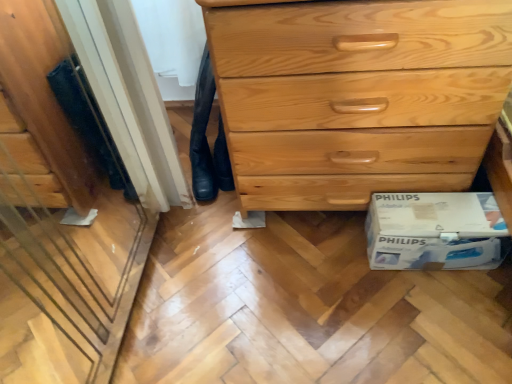
Locate an element on the screen. This screenshot has height=384, width=512. black leather jeans at lower center is located at coordinates (206, 140).

In order to click on light wood chest of drawers at center in this screenshot , I will do `click(357, 96)`.

Where is `black leather jeans at lower center`? This screenshot has width=512, height=384. black leather jeans at lower center is located at coordinates (206, 140).

From a real-world perspective, is light wood chest of drawers at center above or below white cardboard box at lower right?

From a real-world perspective, light wood chest of drawers at center is physically above white cardboard box at lower right.

Is light wood chest of drawers at center far away from white cardboard box at lower right?

No, light wood chest of drawers at center is not far from white cardboard box at lower right.

From the image's perspective, between light wood chest of drawers at center and white cardboard box at lower right, who is located below?

white cardboard box at lower right.

How many degrees apart are the facing directions of light wood chest of drawers at center and white cardboard box at lower right?

2.2 degrees.

How many degrees apart are the facing directions of white cardboard box at lower right and black leather jeans at lower center?

They differ by 2.2 degrees in their facing directions.

Where is `cardboard box in front of the black leather jeans at lower center`? This screenshot has width=512, height=384. cardboard box in front of the black leather jeans at lower center is located at coordinates (435, 231).

Is white cardboard box at lower right in contact with black leather jeans at lower center?

No, white cardboard box at lower right is not making contact with black leather jeans at lower center.

Considering the relative sizes of white cardboard box at lower right and black leather jeans at lower center in the image provided, is white cardboard box at lower right taller than black leather jeans at lower center?

No.

Between black leather jeans at lower center and white cardboard box at lower right, which one has smaller size?

black leather jeans at lower center is smaller.

Does black leather jeans at lower center turn towards white cardboard box at lower right?

No, black leather jeans at lower center does not turn towards white cardboard box at lower right.

Measure the distance from black leather jeans at lower center to white cardboard box at lower right.

The distance of black leather jeans at lower center from white cardboard box at lower right is 23.07 inches.

I want to click on cardboard box beneath the black leather jeans at lower center (from a real-world perspective), so click(x=435, y=231).

Are black leather jeans at lower center and light wood chest of drawers at center making contact?

There is a gap between black leather jeans at lower center and light wood chest of drawers at center.

Can you confirm if black leather jeans at lower center is bigger than light wood chest of drawers at center?

A: Actually, black leather jeans at lower center might be smaller than light wood chest of drawers at center.

From the image's perspective, relative to light wood chest of drawers at center, is black leather jeans at lower center above or below?

black leather jeans at lower center is below light wood chest of drawers at center.

Would you say light wood chest of drawers at center is part of black leather jeans at lower center's contents?

Actually, light wood chest of drawers at center is outside black leather jeans at lower center.

How different are the orientations of light wood chest of drawers at center and black leather jeans at lower center in degrees?

The angular difference between light wood chest of drawers at center and black leather jeans at lower center is 0.000324 degrees.

Between point (234, 101) and point (219, 145), which one is positioned behind?

The point (219, 145) is more distant.

Image resolution: width=512 pixels, height=384 pixels. I want to click on chest of drawers located on the right of black leather jeans at lower center, so coord(357,96).

From a real-world perspective, relative to black leather jeans at lower center, is light wood chest of drawers at center vertically above or below?

From a real-world perspective, light wood chest of drawers at center is physically above black leather jeans at lower center.

Which object is thinner, white cardboard box at lower right or light wood chest of drawers at center?

With smaller width is white cardboard box at lower right.

Considering their positions, is white cardboard box at lower right located in front of or behind light wood chest of drawers at center?

white cardboard box at lower right is behind light wood chest of drawers at center.

Is white cardboard box at lower right looking in the opposite direction of light wood chest of drawers at center?

Yes.

How much distance is there between white cardboard box at lower right and light wood chest of drawers at center?

white cardboard box at lower right is 9.05 inches from light wood chest of drawers at center.

Locate an element on the screen. chest of drawers in front of the white cardboard box at lower right is located at coordinates (357, 96).

At what (x,y) coordinates should I click in order to perform the action: click on jeans above the white cardboard box at lower right (from a real-world perspective). Please return your answer as a coordinate pair (x, y). Looking at the image, I should click on 206,140.

Looking at the image, which one is located further to black leather jeans at lower center, white cardboard box at lower right or light wood chest of drawers at center?

white cardboard box at lower right.

From the image, which object appears to be nearer to white cardboard box at lower right, light wood chest of drawers at center or black leather jeans at lower center?

light wood chest of drawers at center is positioned closer to the anchor white cardboard box at lower right.

When comparing their distances from white cardboard box at lower right, does black leather jeans at lower center or light wood chest of drawers at center seem closer?

Based on the image, light wood chest of drawers at center appears to be nearer to white cardboard box at lower right.

From the image, which object appears to be farther from black leather jeans at lower center, light wood chest of drawers at center or white cardboard box at lower right?

Based on the image, white cardboard box at lower right appears to be further to black leather jeans at lower center.

From the image, which object appears to be nearer to light wood chest of drawers at center, white cardboard box at lower right or black leather jeans at lower center?

white cardboard box at lower right is positioned closer to the anchor light wood chest of drawers at center.

Based on their spatial positions, is black leather jeans at lower center or white cardboard box at lower right closer to light wood chest of drawers at center?

Among the two, white cardboard box at lower right is located nearer to light wood chest of drawers at center.

I want to click on the chest of drawers located between black leather jeans at lower center and white cardboard box at lower right in the left-right direction, so click(357, 96).